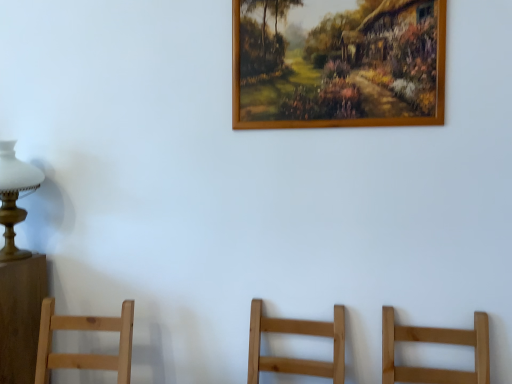
Identify the location of wooden picture frame at upper center. (340, 67).

This screenshot has height=384, width=512. What do you see at coordinates (340, 67) in the screenshot?
I see `wooden picture frame at upper center` at bounding box center [340, 67].

Describe the element at coordinates (14, 196) in the screenshot. I see `matte white glass at left` at that location.

Identify the location of matte white glass at left. (14, 196).

Measure the distance between point (x=6, y=170) and camera.

A distance of 1.59 meters exists between point (x=6, y=170) and camera.

Where is `wooden picture frame at upper center`? wooden picture frame at upper center is located at coordinates (340, 67).

Can you confirm if matte white glass at left is positioned to the right of wooden picture frame at upper center?

Incorrect, matte white glass at left is not on the right side of wooden picture frame at upper center.

Considering the relative positions of matte white glass at left and wooden picture frame at upper center in the image provided, is matte white glass at left behind wooden picture frame at upper center?

Yes, it is behind wooden picture frame at upper center.

Considering the points (18, 258) and (416, 82), which point is behind, point (18, 258) or point (416, 82)?

Positioned behind is point (18, 258).

From the image's perspective, relative to wooden picture frame at upper center, is matte white glass at left above or below?

Clearly, from the image's perspective, matte white glass at left is below wooden picture frame at upper center.

From a real-world perspective, is matte white glass at left physically located above or below wooden picture frame at upper center?

matte white glass at left is below wooden picture frame at upper center.

Considering the sizes of objects matte white glass at left and wooden picture frame at upper center in the image provided, who is wider, matte white glass at left or wooden picture frame at upper center?

Wider between the two is matte white glass at left.

Between matte white glass at left and wooden picture frame at upper center, which one has less height?

matte white glass at left.

Considering the sizes of objects matte white glass at left and wooden picture frame at upper center in the image provided, who is smaller, matte white glass at left or wooden picture frame at upper center?

wooden picture frame at upper center.

Is wooden picture frame at upper center surrounded by matte white glass at left?

No.

Is matte white glass at left positioned far away from wooden picture frame at upper center?

Yes, matte white glass at left and wooden picture frame at upper center are quite far apart.

Is matte white glass at left positioned with its back to wooden picture frame at upper center?

That's not correct — matte white glass at left is not looking away from wooden picture frame at upper center.

You are a GUI agent. You are given a task and a screenshot of the screen. Output one action in this format:
    pyautogui.click(x=<x>, y=<y>)
    Task: Click on the picture frame lying on the right of matte white glass at left
    This screenshot has height=384, width=512.
    Given the screenshot: What is the action you would take?
    pyautogui.click(x=340, y=67)

Between wooden picture frame at upper center and matte white glass at left, which one appears on the right side from the viewer's perspective?

Positioned to the right is wooden picture frame at upper center.

In the scene shown: Is wooden picture frame at upper center behind matte white glass at left?

No, the depth of wooden picture frame at upper center is less than that of matte white glass at left.

Between point (322, 65) and point (13, 219), which one is positioned behind?

The point (13, 219) is farther from the camera.

From the image's perspective, which is below, wooden picture frame at upper center or matte white glass at left?

matte white glass at left appears lower in the image.

From a real-world perspective, which object rests below the other?

matte white glass at left.

Between wooden picture frame at upper center and matte white glass at left, which one has smaller width?

wooden picture frame at upper center is thinner.

Considering the relative sizes of wooden picture frame at upper center and matte white glass at left in the image provided, is wooden picture frame at upper center taller than matte white glass at left?

Correct, wooden picture frame at upper center is much taller as matte white glass at left.

Considering the relative sizes of wooden picture frame at upper center and matte white glass at left in the image provided, is wooden picture frame at upper center smaller than matte white glass at left?

Indeed, wooden picture frame at upper center has a smaller size compared to matte white glass at left.

Is wooden picture frame at upper center positioned beyond the bounds of matte white glass at left?

Yes.

Consider the image. Is wooden picture frame at upper center with matte white glass at left?

No, wooden picture frame at upper center is not touching matte white glass at left.

Could you tell me if wooden picture frame at upper center is turned towards matte white glass at left?

No, wooden picture frame at upper center is not facing towards matte white glass at left.

Measure the distance between wooden picture frame at upper center and matte white glass at left.

They are 1.13 meters apart.

This screenshot has height=384, width=512. I want to click on table lamp lying below the wooden picture frame at upper center (from the image's perspective), so click(x=14, y=196).

Where is `table lamp behind the wooden picture frame at upper center`? Image resolution: width=512 pixels, height=384 pixels. table lamp behind the wooden picture frame at upper center is located at coordinates (14, 196).

Find the location of a particular element. The width and height of the screenshot is (512, 384). table lamp below the wooden picture frame at upper center (from the image's perspective) is located at coordinates point(14,196).